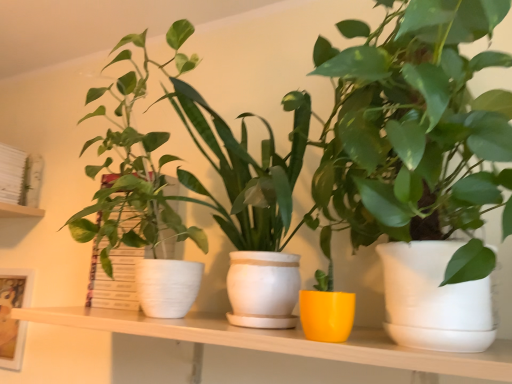
Question: Does matte white pot at center, placed as the third houseplant when sorted from left to right, have a lesser height compared to yellow matte pot at center, which is the second houseplant in right-to-left order?

Choices:
 (A) yes
 (B) no

Answer: (B)

Question: Is matte white pot at center, which is the first houseplant from right to left, with yellow matte pot at center, which is the second houseplant in right-to-left order?

Choices:
 (A) no
 (B) yes

Answer: (A)

Question: Considering the relative sizes of matte white pot at center, placed as the third houseplant when sorted from left to right, and yellow matte pot at center, which is the second houseplant in right-to-left order, in the image provided, is matte white pot at center, placed as the third houseplant when sorted from left to right, thinner than yellow matte pot at center, which is the second houseplant in right-to-left order,?

Choices:
 (A) no
 (B) yes

Answer: (A)

Question: Is matte white pot at center, placed as the third houseplant when sorted from left to right, looking in the opposite direction of yellow matte pot at center, which is the second houseplant in right-to-left order?

Choices:
 (A) yes
 (B) no

Answer: (B)

Question: Considering the relative positions of matte white pot at center, placed as the third houseplant when sorted from left to right, and yellow matte pot at center, positioned as the second houseplant in left-to-right order, in the image provided, is matte white pot at center, placed as the third houseplant when sorted from left to right, in front of yellow matte pot at center, positioned as the second houseplant in left-to-right order,?

Choices:
 (A) no
 (B) yes

Answer: (B)

Question: From the image's perspective, would you say matte white pot at center, placed as the third houseplant when sorted from left to right, is positioned over yellow matte pot at center, which is the second houseplant in right-to-left order?

Choices:
 (A) no
 (B) yes

Answer: (B)

Question: From the image's perspective, is yellow matte pot at center, positioned as the second houseplant in left-to-right order, on white matte bookshelf at upper left?

Choices:
 (A) no
 (B) yes

Answer: (A)

Question: Is yellow matte pot at center, positioned as the second houseplant in left-to-right order, smaller than white matte bookshelf at upper left?

Choices:
 (A) yes
 (B) no

Answer: (B)

Question: Is yellow matte pot at center, positioned as the second houseplant in left-to-right order, looking in the opposite direction of white matte bookshelf at upper left?

Choices:
 (A) no
 (B) yes

Answer: (A)

Question: Is white matte bookshelf at upper left located within yellow matte pot at center, positioned as the second houseplant in left-to-right order?

Choices:
 (A) no
 (B) yes

Answer: (A)

Question: Is yellow matte pot at center, which is the second houseplant in right-to-left order, closer to the viewer compared to white matte bookshelf at upper left?

Choices:
 (A) yes
 (B) no

Answer: (A)

Question: Considering the relative positions of yellow matte pot at center, which is the second houseplant in right-to-left order, and white matte bookshelf at upper left in the image provided, is yellow matte pot at center, which is the second houseplant in right-to-left order, to the left of white matte bookshelf at upper left from the viewer's perspective?

Choices:
 (A) yes
 (B) no

Answer: (B)

Question: Is matte white pot at center, placed as the third houseplant when sorted from left to right, to the left of matte white picture frame at left from the viewer's perspective?

Choices:
 (A) yes
 (B) no

Answer: (B)